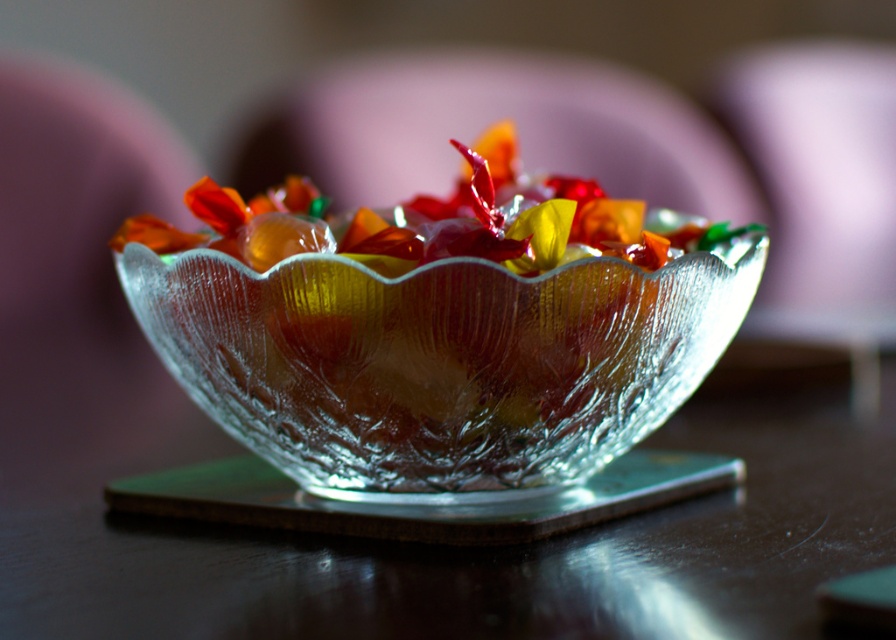
You are standing in front of a table with a glass bowl. The bowl has a scalloped rim and contains colorful candies. There is a specific point at coordinates [438,362]. What object is located at this point?

The point at [438,362] indicates the transparent textured glass bowl at center.

You are a caterer arranging desserts on a table. You have a transparent textured glass bowl at center and a transparent glass plate at center. You need to place a cake that is 2.5 inches wide on the table without overlapping any existing items. Is there enough space between the two items to place the cake?

The distance between the transparent textured glass bowl at center and the transparent glass plate at center is 2.07 inches. Since the cake is 2.5 inches wide, which is wider than the space available, there is not enough space to place the cake between them without overlapping.

You are a delivery person who needs to place a second bowl next to the transparent textured glass bowl at center. The second bowl is the translucent glass bowl at center. The minimum required distance between the two bowls to prevent them from touching is 1.5 inches. Can you safely place the second bowl without them touching?

The distance between the transparent textured glass bowl at center and the translucent glass bowl at center is 1.51 inches, which is just over the required 1.5 inches. Therefore, you can safely place the second bowl without them touching.